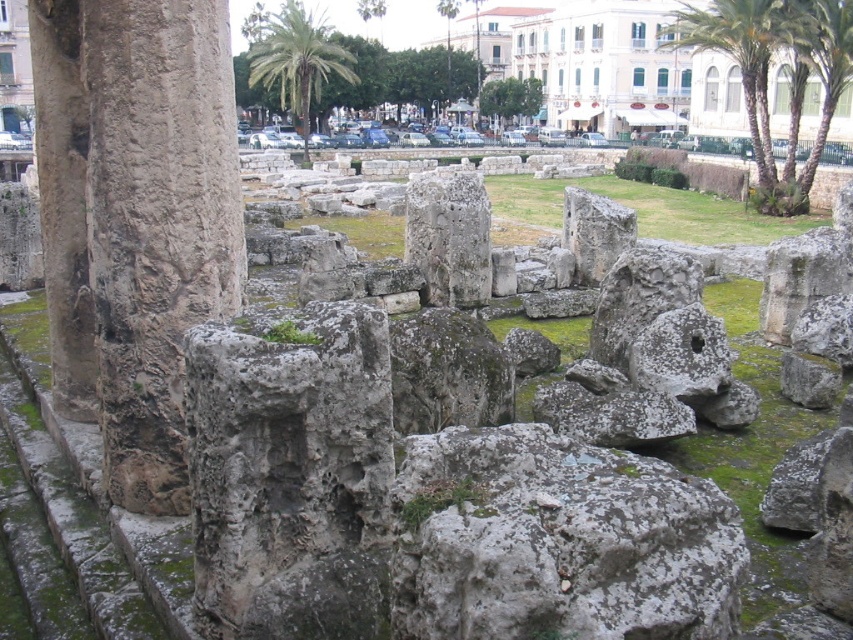
Is point (654, 212) positioned behind point (321, 84)?

That is False.

Locate an element on the screen. This screenshot has height=640, width=853. green grass at center is located at coordinates (646, 209).

What do you see at coordinates (646, 209) in the screenshot? I see `green grass at center` at bounding box center [646, 209].

This screenshot has height=640, width=853. I want to click on green grass at center, so click(x=646, y=209).

Locate an element on the screen. The width and height of the screenshot is (853, 640). green leafy palm tree at upper right is located at coordinates (747, 77).

Who is more distant from viewer, (749, 93) or (828, 42)?

The point (749, 93) is more distant.

Who is more distant from viewer, (733, 29) or (827, 28)?

The point (733, 29) is more distant.

You are a GUI agent. You are given a task and a screenshot of the screen. Output one action in this format:
    pyautogui.click(x=<x>, y=<y>)
    Task: Click on the green leafy palm tree at upper right
    The height and width of the screenshot is (640, 853).
    Given the screenshot: What is the action you would take?
    pyautogui.click(x=747, y=77)

Is rough stone column at left in front of green grass at center?

Yes, it is.

Is rough stone column at left smaller than green grass at center?

Yes.

This screenshot has height=640, width=853. What are the coordinates of `rough stone column at left` in the screenshot? It's located at (135, 220).

Where is `rough stone column at left`? The height and width of the screenshot is (640, 853). rough stone column at left is located at coordinates (135, 220).